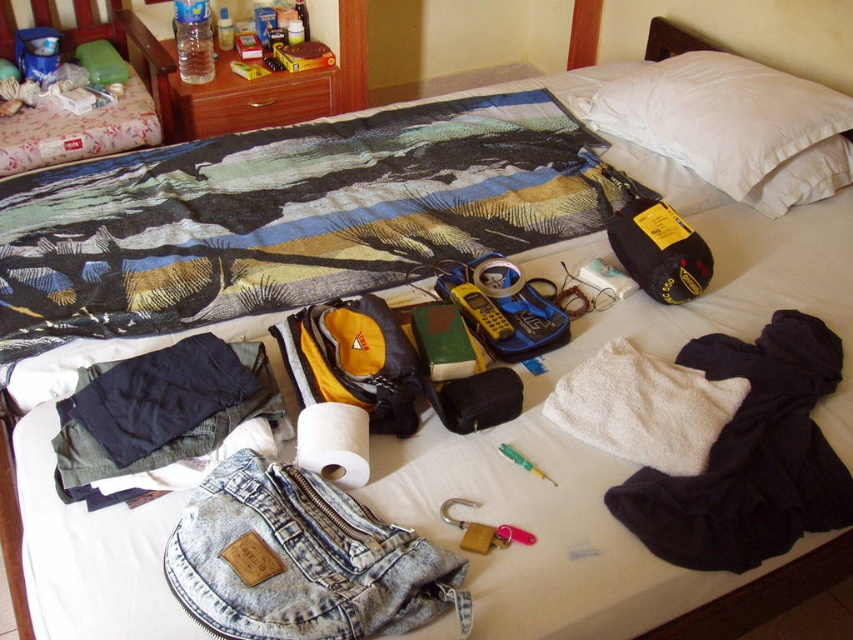
Consider the image. Which is more to the left, faded denim jacket at lower center or white soft towel at center?

faded denim jacket at lower center

From the picture: Does faded denim jacket at lower center appear over white soft towel at center?

No.

Is point (386, 582) closer to viewer compared to point (693, 550)?

Yes, point (386, 582) is closer to viewer.

You are a GUI agent. You are given a task and a screenshot of the screen. Output one action in this format:
    pyautogui.click(x=<x>, y=<y>)
    Task: Click on the faded denim jacket at lower center
    
    Given the screenshot: What is the action you would take?
    pyautogui.click(x=302, y=561)

Between point (341, 573) and point (474, 269), which one is positioned behind?

The point (474, 269) is more distant.

The width and height of the screenshot is (853, 640). What are the coordinates of `faded denim jacket at lower center` in the screenshot? It's located at (302, 561).

At what (x,y) coordinates should I click in order to perform the action: click on faded denim jacket at lower center. Please return your answer as a coordinate pair (x, y). This screenshot has height=640, width=853. Looking at the image, I should click on (302, 561).

Locate an element on the screen. faded denim jacket at lower center is located at coordinates click(302, 561).

Does white soft towel at center appear on the right side of yellow plastic phone at center?

Yes, white soft towel at center is to the right of yellow plastic phone at center.

Does point (827, 493) come closer to viewer compared to point (535, 330)?

Yes.

This screenshot has height=640, width=853. I want to click on white soft towel at center, so click(x=749, y=456).